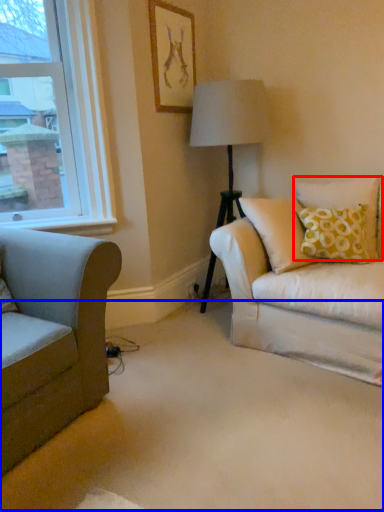
Question: Which point is closer to the camera, pillow (highlighted by a red box) or plain (highlighted by a blue box)?

Choices:
 (A) pillow
 (B) plain

Answer: (B)